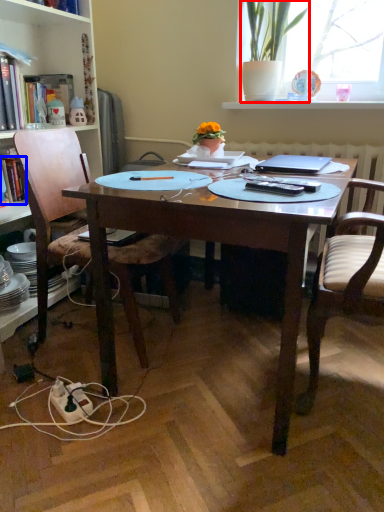
Question: Which object is closer to the camera taking this photo, houseplant (highlighted by a red box) or book (highlighted by a blue box)?

Choices:
 (A) houseplant
 (B) book

Answer: (A)